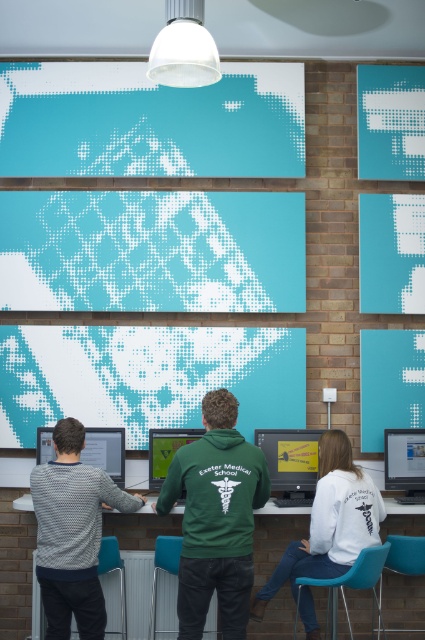
You are setting up a camera to take a photo of the patterned sweater at left and the green matte monitor at center. The camera requires a minimum distance of 30 inches between objects to focus properly. Will the camera be able to focus on both objects simultaneously?

The patterned sweater at left and green matte monitor at center are 28.72 inches apart, which is less than the required 30 inches. Therefore, the camera may struggle to focus on both objects simultaneously due to the insufficient distance between them.

You are setting up a presentation in the Exeter Medical School workspace. You need to choose a monitor that can display more content vertically. Which monitor should you select between the matte yellow monitor at center and the matte black monitor at lower left?

The matte yellow monitor at center is much taller than the matte black monitor at lower left, so you should select the matte yellow monitor at center to display more content vertically.

You are a student at Exeter Medical School and you need to place a heavy textbook on the wooden table at center. However, there is a patterned sweater at left hanging above it. Will the sweater interfere with placing the book on the table?

The wooden table at center is positioned under the patterned sweater at left, so the sweater is hanging above the table. This means placing the textbook on the table should not be obstructed by the sweater as it is above and not on the table itself.